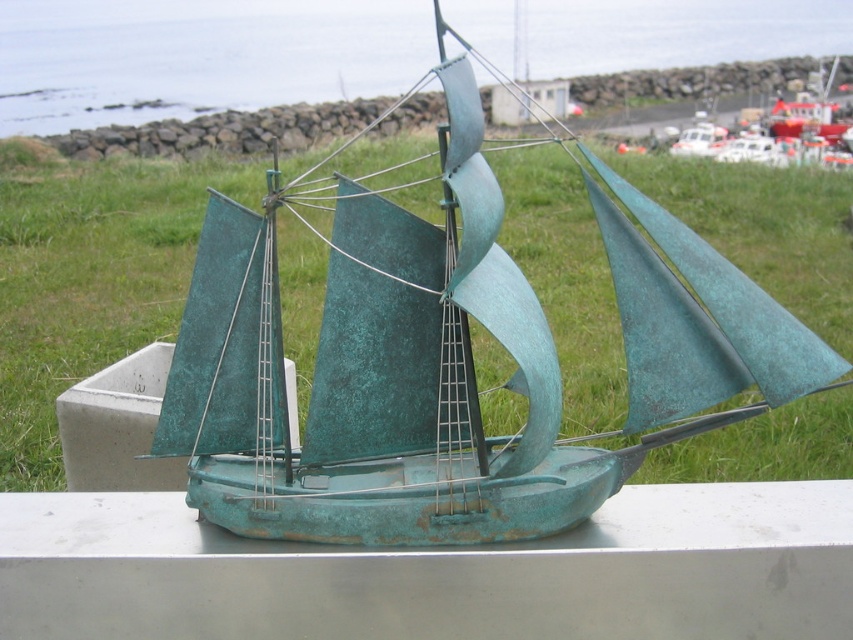
Question: Which point is closer to the camera taking this photo?

Choices:
 (A) (218, 579)
 (B) (16, 417)
 (C) (245, 64)

Answer: (A)

Question: Can you confirm if green grass at center is wider than smooth concrete ledge at center?

Choices:
 (A) yes
 (B) no

Answer: (A)

Question: Which point is closer to the camera taking this photo?

Choices:
 (A) (538, 632)
 (B) (285, 22)

Answer: (A)

Question: Does green grass at center lie behind green patina water at upper center?

Choices:
 (A) yes
 (B) no

Answer: (A)

Question: Does green grass at center have a smaller size compared to smooth concrete ledge at center?

Choices:
 (A) no
 (B) yes

Answer: (A)

Question: Which point is farther from the camera taking this photo?

Choices:
 (A) (33, 259)
 (B) (408, 45)
 (C) (635, 609)

Answer: (B)